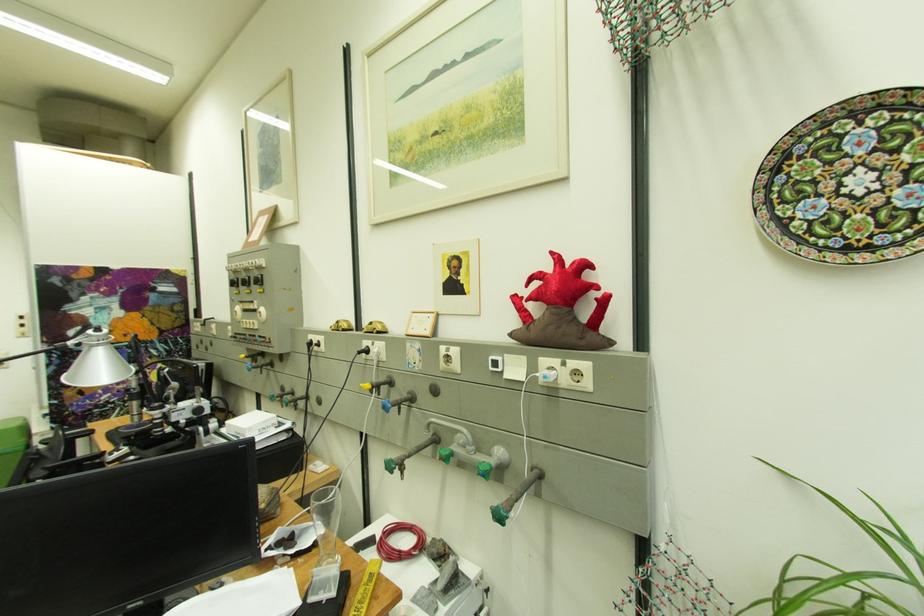
In order to click on white light switch in this screenshot , I will do click(x=577, y=375).